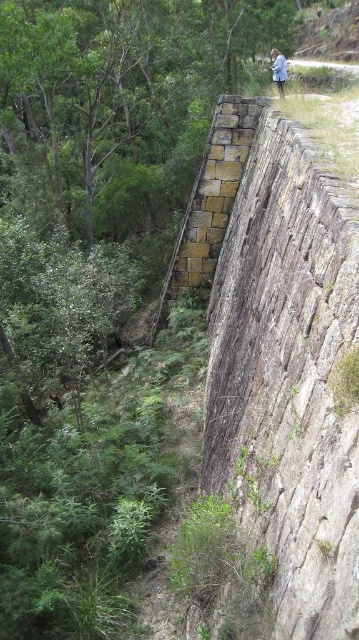
You are standing in front of the brown stone wall at center. If you want to reach the dense greenery to your left, which direction should you move relative to the wall?

You should move to the left relative to the brown stone wall at center to reach the dense greenery.

You are standing in front of the stone wall and notice a green leafy tree at upper left and a blue cotton shirt at upper center. Which object is positioned to the left of the other?

The green leafy tree at upper left is positioned to the left of the blue cotton shirt at upper center.

You are standing in front of the scene described. Where exactly is the brown stone wall at center located in terms of its 2D coordinates?

The brown stone wall at center is located at the 2D coordinates of point (287, 378).